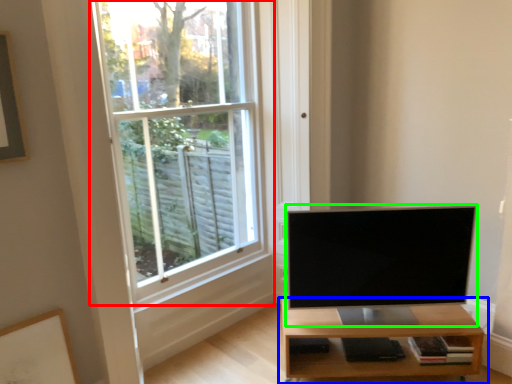
Question: Which object is the farthest from window (highlighted by a red box)? Choose among these: shelf (highlighted by a blue box) or television (highlighted by a green box).

Choices:
 (A) shelf
 (B) television

Answer: (A)